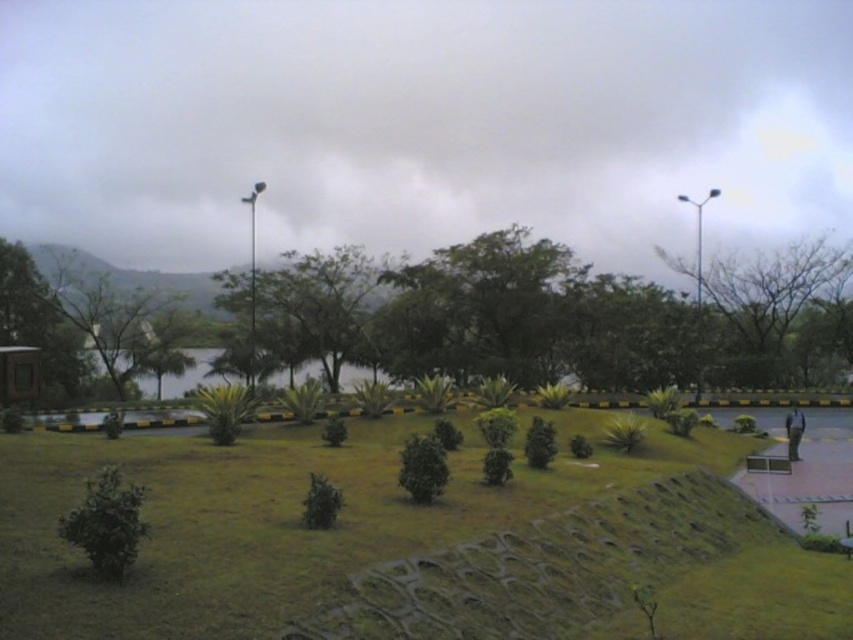
You are a landscape architect designing a new park and want to place a bench between the green leafy tree at right and the green grassy lake at center. Which side of the bench should face the thinner object to ensure visitors can comfortably view the wider area?

The green leafy tree at right is thinner than the green grassy lake at center. To ensure visitors can comfortably view the wider area, the bench should face the green grassy lake at center since it is wider than the tree.

You are standing at the center of the image and want to walk to the point marked at coordinates point (120, 323). Is that point located on the green leafy tree at left?

Yes, the point (120, 323) is located on the green leafy tree at left.

You are standing at the center of the image and want to walk to the green leafy tree at center. Which direction should you go?

The green leafy tree at center is located at point coordinates of (308, 301), so you should move towards the center of the image to reach it.